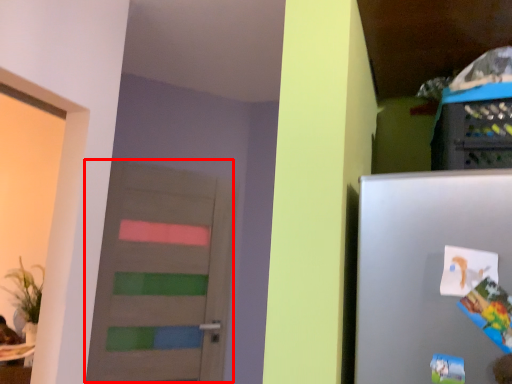
Question: From the image's perspective, what is the correct spatial relationship of door (annotated by the red box) in relation to comic book?

Choices:
 (A) above
 (B) below

Answer: (B)